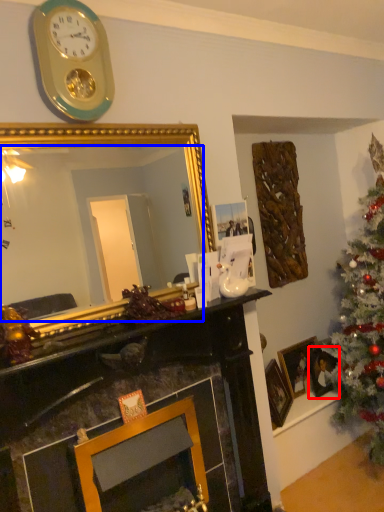
Question: Which object is closer to the camera taking this photo, picture frame (highlighted by a red box) or mirror (highlighted by a blue box)?

Choices:
 (A) picture frame
 (B) mirror

Answer: (B)